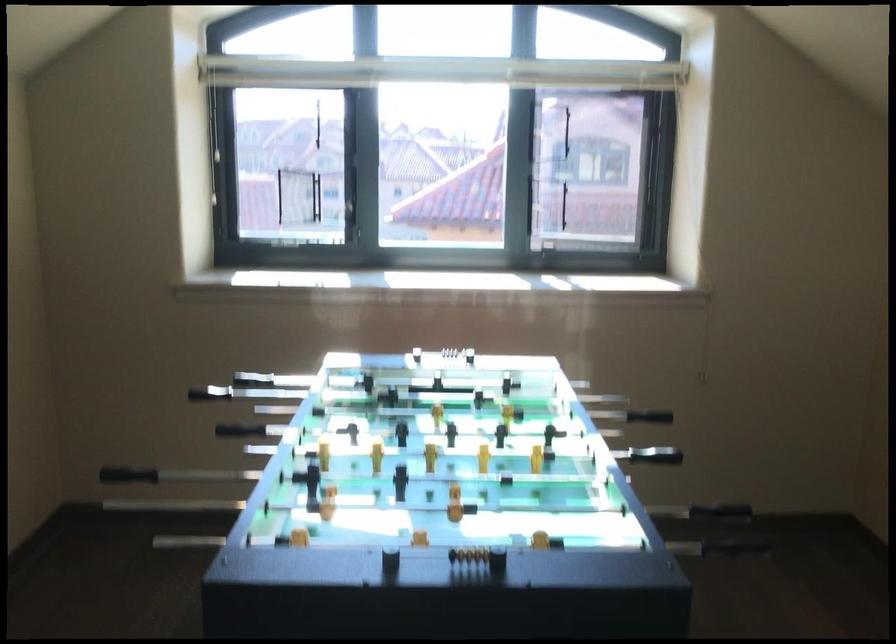
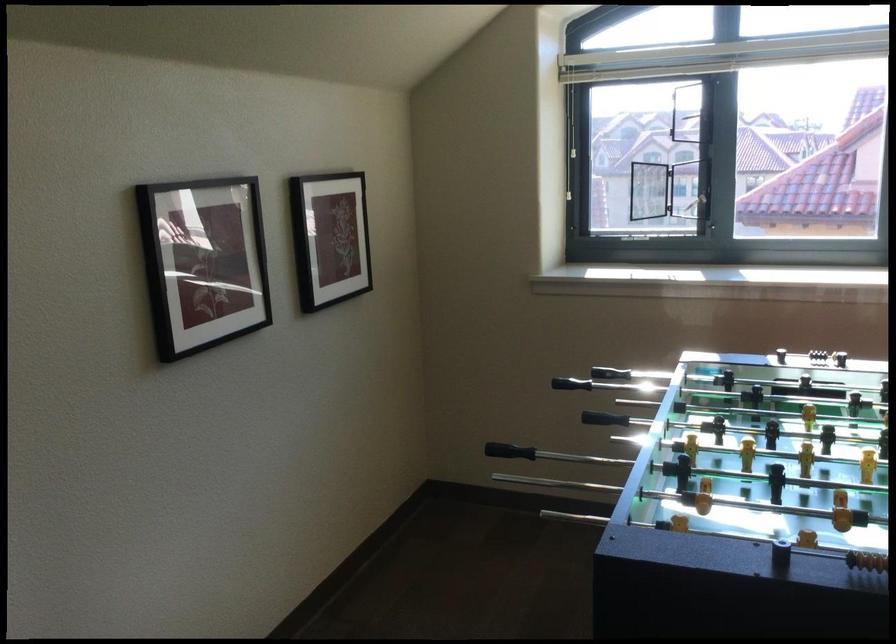
The point at (328, 196) is marked in the first image. Where is the corresponding point in the second image?

(688, 189)